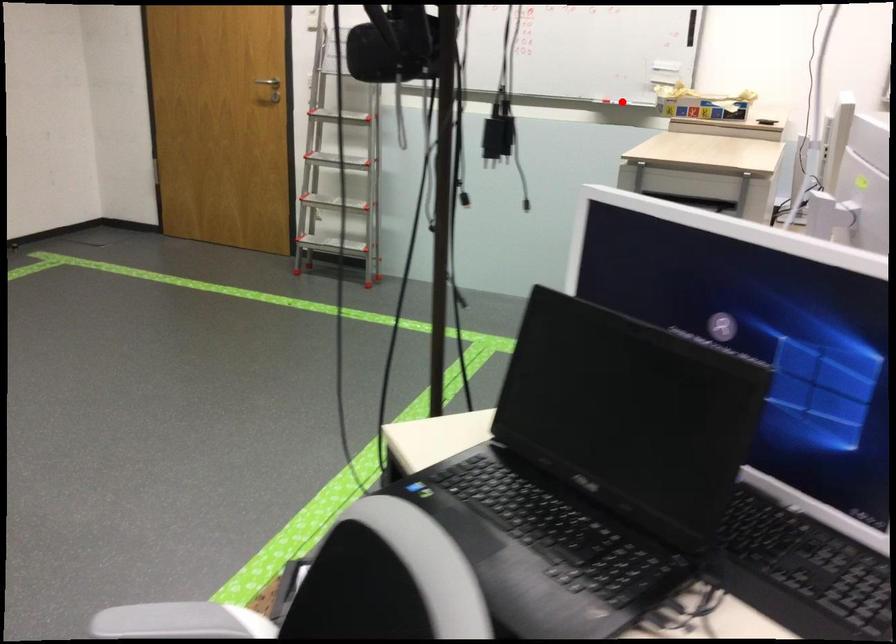
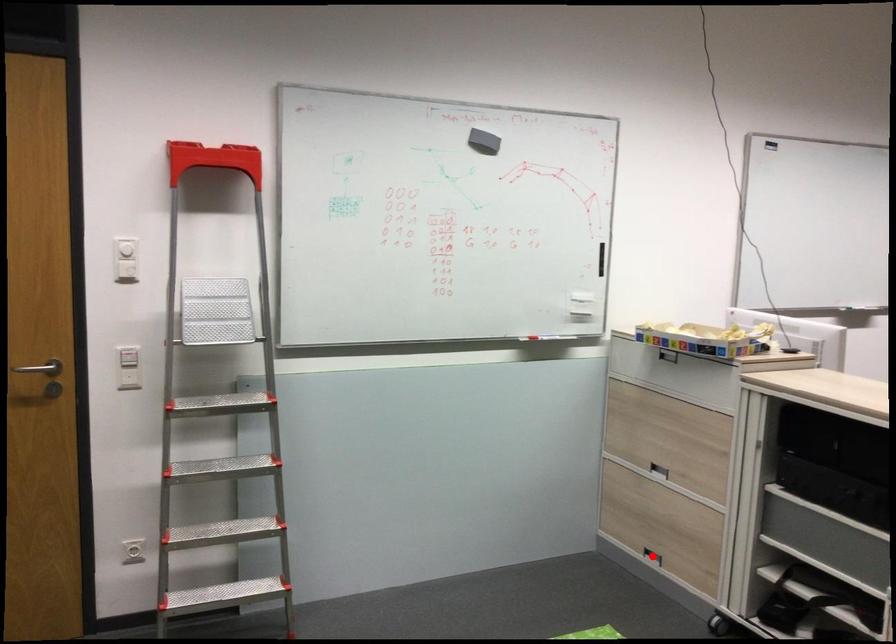
I am providing you with two images of the same scene from different viewpoints. A red point is marked on the first image and another point is marked on the second image. Is the marked point in image1 the same physical position as the marked point in image2?

No